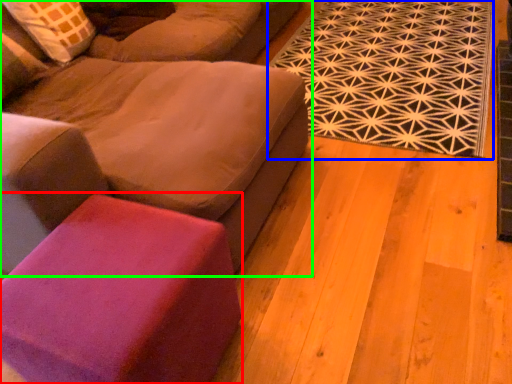
Question: Considering the real-world distances, which object is farthest from stool (highlighted by a red box)? mat (highlighted by a blue box) or studio couch (highlighted by a green box)?

Choices:
 (A) mat
 (B) studio couch

Answer: (A)